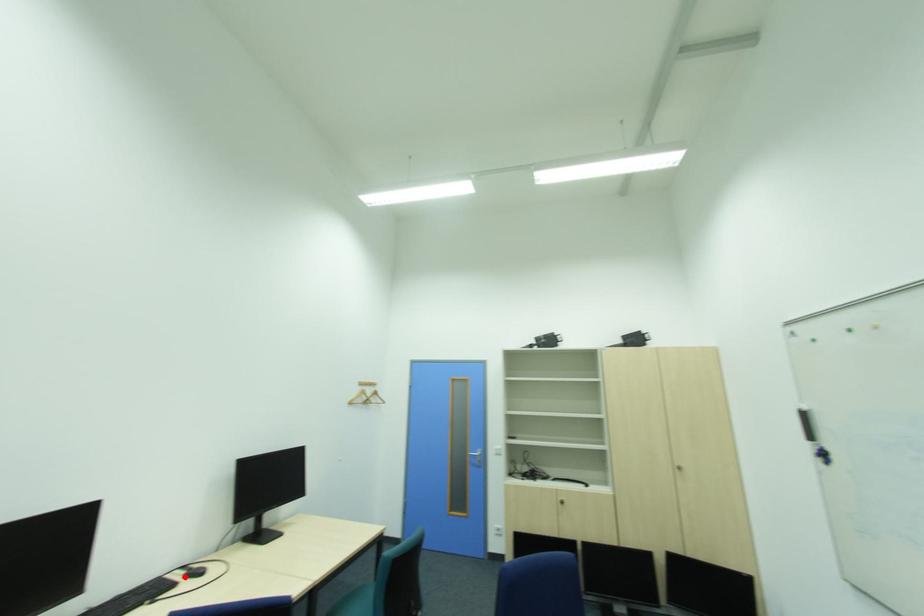
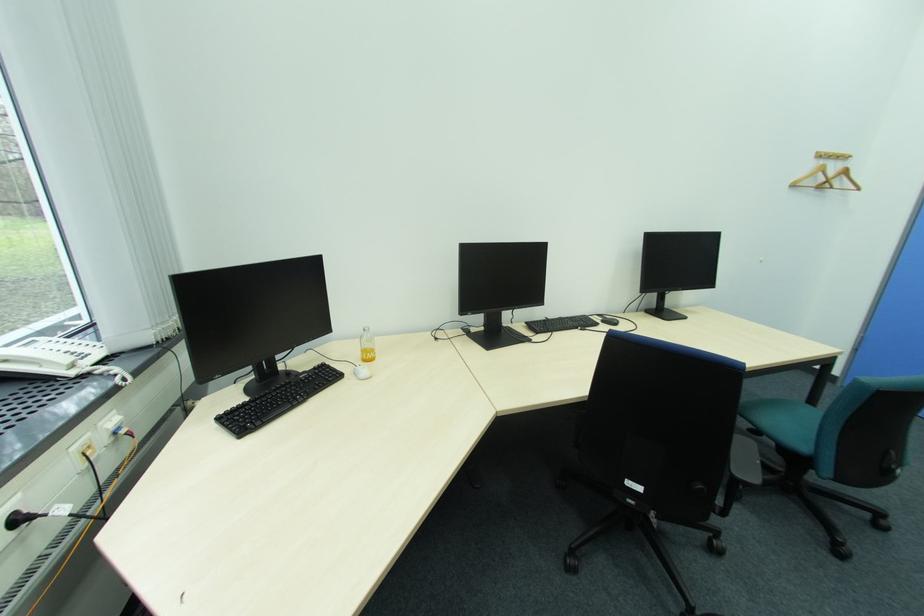
Find the pixel in the second image that matches the highlighted location in the first image.

(604, 320)